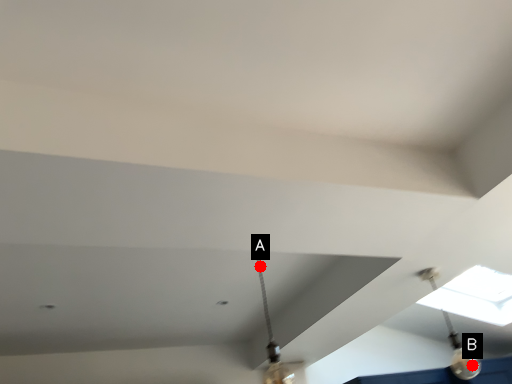
Question: Two points are circled on the image, labeled by A and B beside each circle. Among these points, which one is nearest to the camera?

Choices:
 (A) A is closer
 (B) B is closer

Answer: (A)